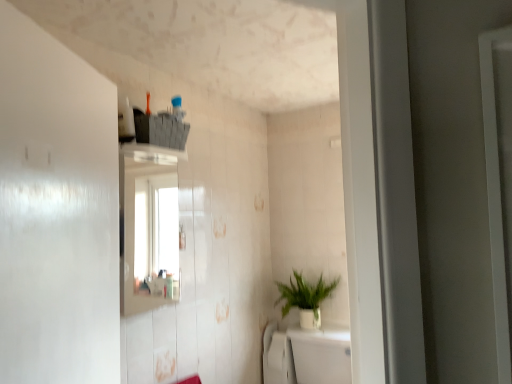
The width and height of the screenshot is (512, 384). What do you see at coordinates (305, 299) in the screenshot? I see `green matte plant at center` at bounding box center [305, 299].

Where is `green matte plant at center`? green matte plant at center is located at coordinates [305, 299].

Locate an element on the screen. The height and width of the screenshot is (384, 512). white glossy bath at lower center is located at coordinates (306, 355).

In order to face white glossy bath at lower center, should I rotate leftwards or rightwards?

You should rotate right by 7.629 degrees.

What do you see at coordinates (306, 355) in the screenshot?
I see `white glossy bath at lower center` at bounding box center [306, 355].

The height and width of the screenshot is (384, 512). Identify the location of green matte plant at center. (305, 299).

Is white glossy bath at lower center to the left of green matte plant at center from the viewer's perspective?

No.

Which object is further away from the camera, white glossy bath at lower center or green matte plant at center?

green matte plant at center is more distant.

Is point (296, 373) closer to viewer compared to point (316, 307)?

Yes, point (296, 373) is closer to viewer.

From the image's perspective, which one is positioned lower, white glossy bath at lower center or green matte plant at center?

From the image's view, white glossy bath at lower center is below.

Consider the image. From a real-world perspective, who is located higher, white glossy bath at lower center or green matte plant at center?

green matte plant at center.

Which of these two, white glossy bath at lower center or green matte plant at center, is thinner?

green matte plant at center is thinner.

Who is taller, white glossy bath at lower center or green matte plant at center?

Standing taller between the two is white glossy bath at lower center.

Considering the sizes of objects white glossy bath at lower center and green matte plant at center in the image provided, who is bigger, white glossy bath at lower center or green matte plant at center?

white glossy bath at lower center is bigger.

Would you say green matte plant at center is part of white glossy bath at lower center's contents?

Definitely not — green matte plant at center is not inside white glossy bath at lower center.

Is white glossy bath at lower center beside green matte plant at center?

No, white glossy bath at lower center is not beside green matte plant at center.

Could you tell me if white glossy bath at lower center is facing green matte plant at center?

No, white glossy bath at lower center is not aimed at green matte plant at center.

How many degrees apart are the facing directions of white glossy bath at lower center and green matte plant at center?

The facing directions of white glossy bath at lower center and green matte plant at center are 1.61 degrees apart.

Image resolution: width=512 pixels, height=384 pixels. What are the coordinates of `bath that is on the right side of green matte plant at center` in the screenshot? It's located at (306, 355).

Is green matte plant at center at the right side of white glossy bath at lower center?

In fact, green matte plant at center is to the left of white glossy bath at lower center.

Is green matte plant at center in front of or behind white glossy bath at lower center in the image?

green matte plant at center is behind white glossy bath at lower center.

Does point (282, 316) come in front of point (322, 333)?

No, (282, 316) is further to viewer.

From the image's perspective, between green matte plant at center and white glossy bath at lower center, which one is located above?

green matte plant at center, from the image's perspective.

From a real-world perspective, is green matte plant at center below white glossy bath at lower center?

No, from a real-world perspective, green matte plant at center is not under white glossy bath at lower center.

Can you confirm if green matte plant at center is wider than white glossy bath at lower center?

In fact, green matte plant at center might be narrower than white glossy bath at lower center.

Looking at this image, considering the sizes of objects green matte plant at center and white glossy bath at lower center in the image provided, who is shorter, green matte plant at center or white glossy bath at lower center?

With less height is green matte plant at center.

From the picture: In terms of size, does green matte plant at center appear bigger or smaller than white glossy bath at lower center?

Considering their sizes, green matte plant at center takes up less space than white glossy bath at lower center.

Consider the image. Is white glossy bath at lower center located within green matte plant at center?

No, white glossy bath at lower center is not a part of green matte plant at center.

In the scene shown: Would you consider green matte plant at center to be distant from white glossy bath at lower center?

Actually, green matte plant at center and white glossy bath at lower center are a little close together.

Is green matte plant at center oriented towards white glossy bath at lower center?

No, green matte plant at center is not aimed at white glossy bath at lower center.

Measure the distance between green matte plant at center and white glossy bath at lower center.

green matte plant at center is 7.61 inches away from white glossy bath at lower center.

This screenshot has height=384, width=512. In order to click on bath that appears below the green matte plant at center (from the image's perspective) in this screenshot , I will do (x=306, y=355).

At what (x,y) coordinates should I click in order to perform the action: click on houseplant on the left of the white glossy bath at lower center. Please return your answer as a coordinate pair (x, y). Looking at the image, I should click on (305, 299).

This screenshot has width=512, height=384. I want to click on houseplant lying behind the white glossy bath at lower center, so click(x=305, y=299).